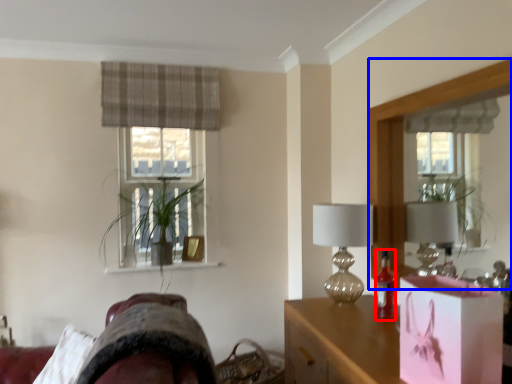
Question: Which object is closer to the camera taking this photo, bottle (highlighted by a red box) or mirror (highlighted by a blue box)?

Choices:
 (A) bottle
 (B) mirror

Answer: (B)